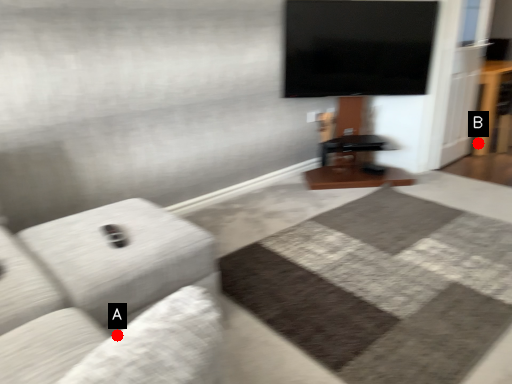
Question: Two points are circled on the image, labeled by A and B beside each circle. Which point is farther to the camera?

Choices:
 (A) A is further
 (B) B is further

Answer: (B)